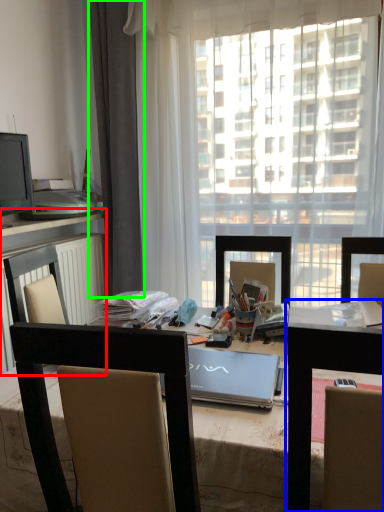
Question: Which is farther away from computer desk (highlighted by a red box)? table (highlighted by a blue box) or curtain (highlighted by a green box)?

Choices:
 (A) table
 (B) curtain

Answer: (A)